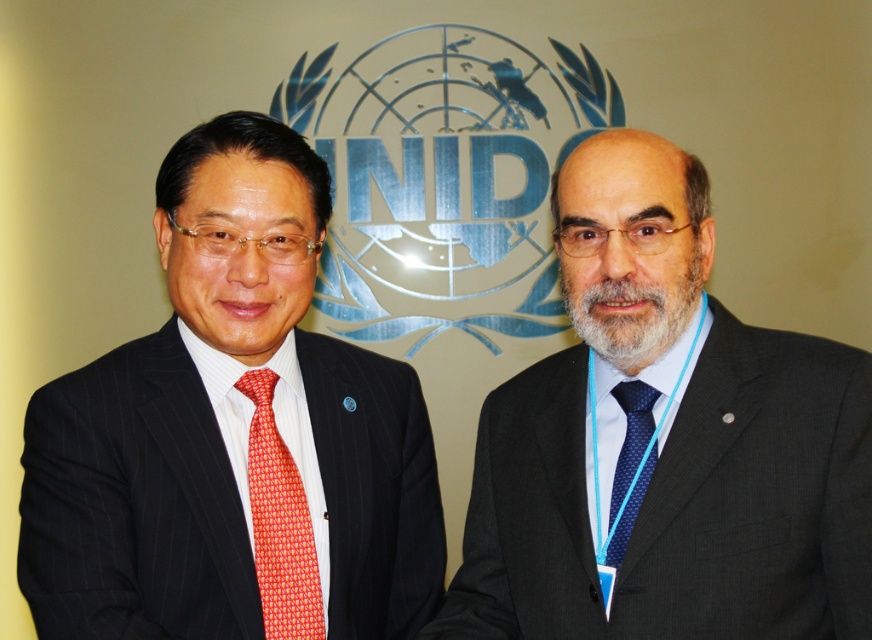
Can you confirm if matte black suit at left is positioned to the right of dark gray suit at center?

No, matte black suit at left is not to the right of dark gray suit at center.

Locate an element on the screen. Image resolution: width=872 pixels, height=640 pixels. matte black suit at left is located at coordinates (232, 435).

Is point (127, 444) farther from viewer compared to point (852, 524)?

Yes, it is.

The width and height of the screenshot is (872, 640). Find the location of `matte black suit at left`. matte black suit at left is located at coordinates (232, 435).

Is matte black suit at left below blue dotted tie at center?

Incorrect, matte black suit at left is not positioned below blue dotted tie at center.

In the scene shown: Who is lower down, matte black suit at left or blue dotted tie at center?

blue dotted tie at center is below.

Who is more forward, (257, 388) or (624, 545)?

Positioned in front is point (624, 545).

Image resolution: width=872 pixels, height=640 pixels. In order to click on matte black suit at left in this screenshot , I will do `click(232, 435)`.

Can you confirm if matte black suit at left is positioned to the left of red silk tie at left?

Indeed, matte black suit at left is positioned on the left side of red silk tie at left.

This screenshot has height=640, width=872. What do you see at coordinates (232, 435) in the screenshot?
I see `matte black suit at left` at bounding box center [232, 435].

You are a GUI agent. You are given a task and a screenshot of the screen. Output one action in this format:
    pyautogui.click(x=<x>, y=<y>)
    Task: Click on the matte black suit at left
    The height and width of the screenshot is (640, 872).
    Given the screenshot: What is the action you would take?
    pyautogui.click(x=232, y=435)

At what (x,y) coordinates should I click in order to perform the action: click on matte black suit at left. Please return your answer as a coordinate pair (x, y). Looking at the image, I should click on (232, 435).